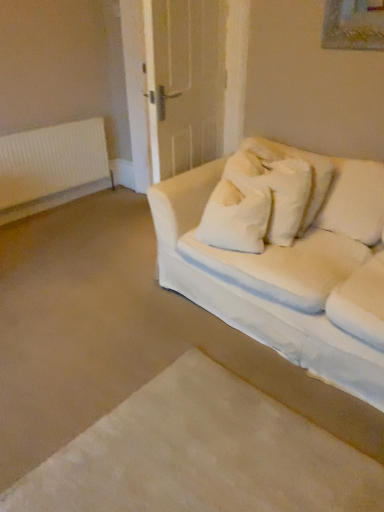
Question: From the image's perspective, is white plastic radiator at left positioned above or below white fabric couch at right?

Choices:
 (A) above
 (B) below

Answer: (A)

Question: Considering their positions, is white plastic radiator at left located in front of or behind white fabric couch at right?

Choices:
 (A) behind
 (B) front

Answer: (A)

Question: Which of these objects is positioned farthest from the white soft carpet at lower left?

Choices:
 (A) white fabric couch at right
 (B) white plastic radiator at left

Answer: (B)

Question: Which object is the closest to the white plastic radiator at left?

Choices:
 (A) white soft carpet at lower left
 (B) white fabric couch at right

Answer: (B)